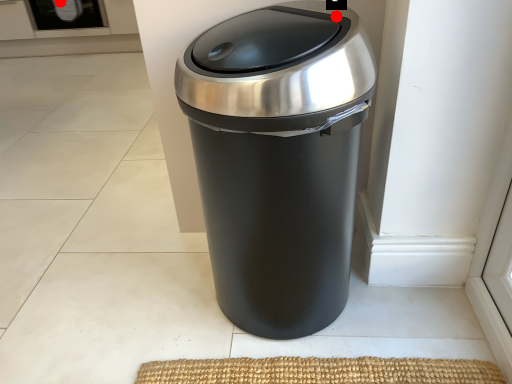
Question: Two points are circled on the image, labeled by A and B beside each circle. Which point is further to the camera?

Choices:
 (A) A is further
 (B) B is further

Answer: (A)